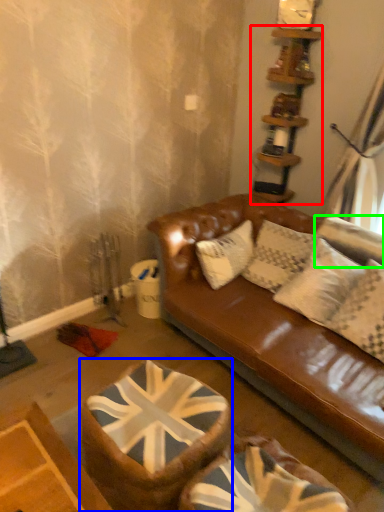
Question: Which object is positioned farthest from shelf (highlighted by a red box)? Select from swivel chair (highlighted by a blue box) and pillow (highlighted by a green box).

Choices:
 (A) swivel chair
 (B) pillow

Answer: (A)